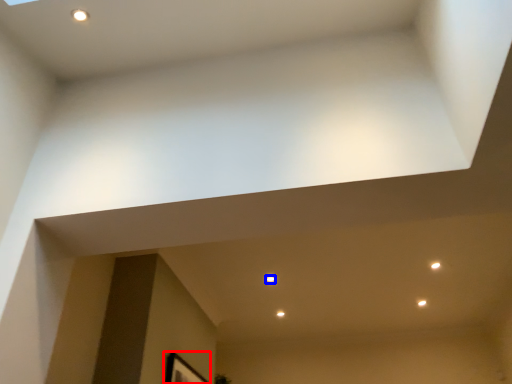
Question: Among these objects, which one is farthest to the camera, picture frame (highlighted by a red box) or light (highlighted by a blue box)?

Choices:
 (A) picture frame
 (B) light

Answer: (B)